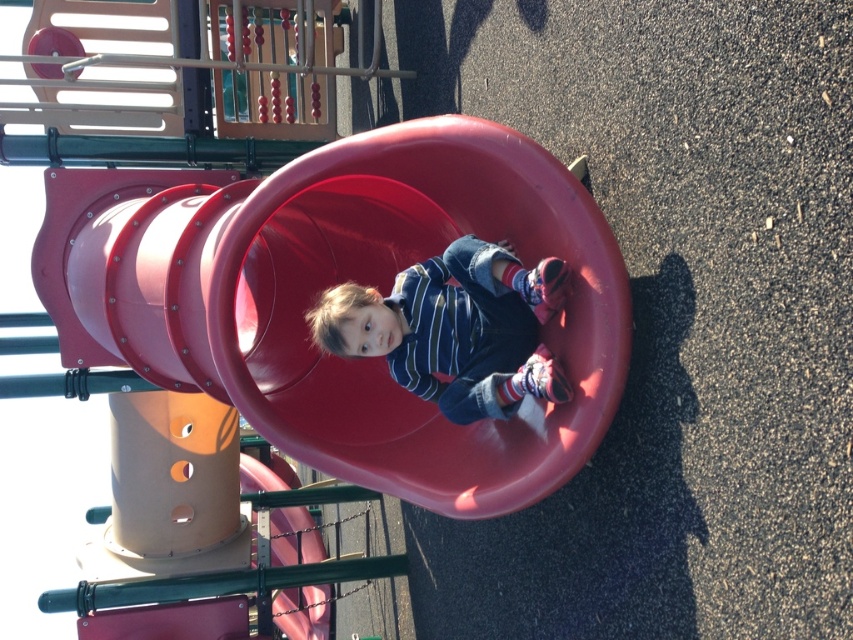
You are a parent at the playground and want to ensure the child is safe. Considering the smooth plastic slide at center and the striped cotton shirt at center, which object is bigger and could potentially block the parent from seeing the child?

The smooth plastic slide at center is larger than the striped cotton shirt at center, so it could potentially block the parent from seeing the child.